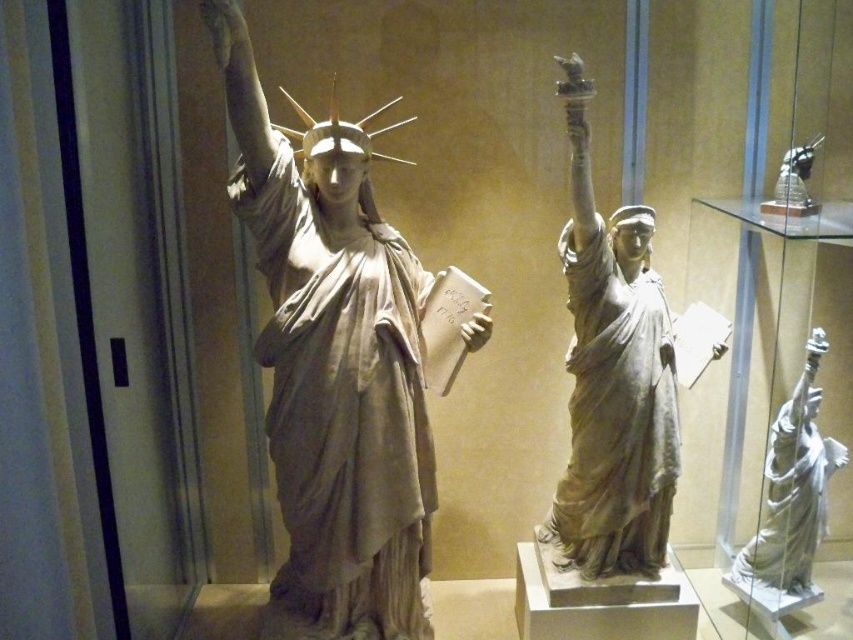
Does matte gray statue at center appear on the left side of satin gold statue at upper right?

Yes, matte gray statue at center is to the left of satin gold statue at upper right.

Image resolution: width=853 pixels, height=640 pixels. I want to click on matte gray statue at center, so click(x=612, y=378).

Does white marble statue at left have a greater width compared to satin gold statue at upper right?

Correct, the width of white marble statue at left exceeds that of satin gold statue at upper right.

This screenshot has width=853, height=640. I want to click on white marble statue at left, so click(334, 371).

Where is `white marble statue at left`? This screenshot has height=640, width=853. white marble statue at left is located at coordinates (334, 371).

Is white marble statue at left bigger than white marble statue at right?

Indeed, white marble statue at left has a larger size compared to white marble statue at right.

Consider the image. Between white marble statue at left and white marble statue at right, which one is positioned lower?

white marble statue at right

Is point (428, 285) more distant than point (798, 436)?

No.

This screenshot has height=640, width=853. Identify the location of white marble statue at left. (334, 371).